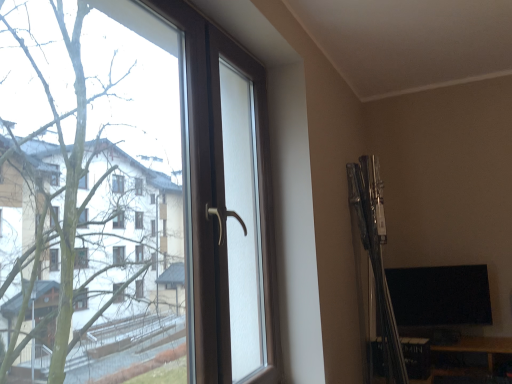
Question: Is brown plastic window at left far from black glossy monitor at lower right?

Choices:
 (A) yes
 (B) no

Answer: (A)

Question: Is brown plastic window at left positioned before black glossy monitor at lower right?

Choices:
 (A) yes
 (B) no

Answer: (A)

Question: Is brown plastic window at left not within black glossy monitor at lower right?

Choices:
 (A) no
 (B) yes

Answer: (B)

Question: Considering the relative sizes of brown plastic window at left and black glossy monitor at lower right in the image provided, is brown plastic window at left wider than black glossy monitor at lower right?

Choices:
 (A) no
 (B) yes

Answer: (B)

Question: Does brown plastic window at left have a lesser height compared to black glossy monitor at lower right?

Choices:
 (A) yes
 (B) no

Answer: (B)

Question: Considering the relative sizes of brown plastic window at left and black glossy monitor at lower right in the image provided, is brown plastic window at left smaller than black glossy monitor at lower right?

Choices:
 (A) yes
 (B) no

Answer: (B)

Question: Is black glossy monitor at lower right to the right of brown plastic window at left from the viewer's perspective?

Choices:
 (A) no
 (B) yes

Answer: (B)

Question: From the image's perspective, is black glossy monitor at lower right over brown plastic window at left?

Choices:
 (A) yes
 (B) no

Answer: (B)

Question: Does black glossy monitor at lower right turn towards brown plastic window at left?

Choices:
 (A) no
 (B) yes

Answer: (A)

Question: Is black glossy monitor at lower right positioned behind brown plastic window at left?

Choices:
 (A) yes
 (B) no

Answer: (A)

Question: Considering the relative sizes of black glossy monitor at lower right and brown plastic window at left in the image provided, is black glossy monitor at lower right bigger than brown plastic window at left?

Choices:
 (A) no
 (B) yes

Answer: (A)

Question: Considering the relative positions of black glossy monitor at lower right and brown plastic window at left in the image provided, is black glossy monitor at lower right to the left of brown plastic window at left from the viewer's perspective?

Choices:
 (A) no
 (B) yes

Answer: (A)

Question: From their relative heights in the image, would you say brown plastic window at left is taller or shorter than black glossy monitor at lower right?

Choices:
 (A) tall
 (B) short

Answer: (A)